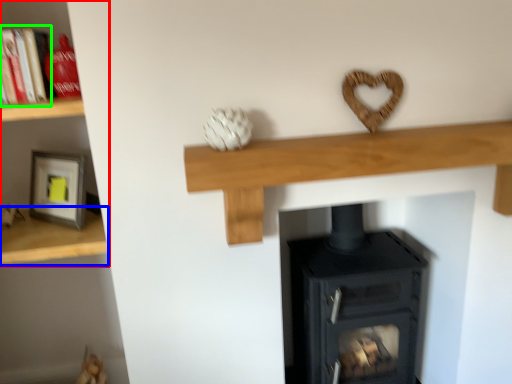
Question: Which is farther away from shelf (highlighted by a red box)? shelf (highlighted by a blue box) or book (highlighted by a green box)?

Choices:
 (A) shelf
 (B) book

Answer: (B)